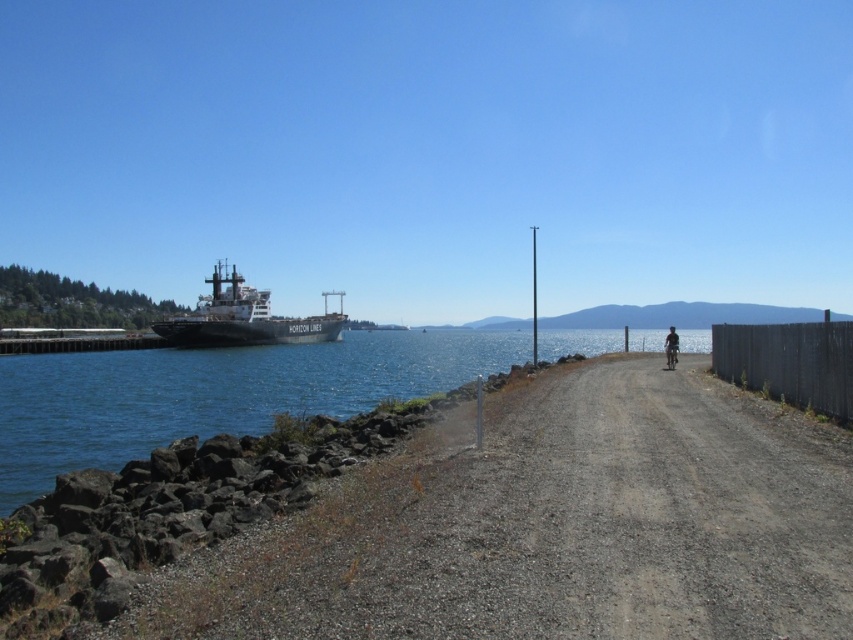
Question: Which object is farther from the camera taking this photo?

Choices:
 (A) dark blue fabric bicycle at right
 (B) white matte cargo ship at left
 (C) blue water at left

Answer: (B)

Question: Among these points, which one is nearest to the camera?

Choices:
 (A) (172, 330)
 (B) (675, 356)
 (C) (846, 416)
 (D) (515, 486)

Answer: (D)

Question: Does dirt/gravel path at center lie behind dark blue fabric bicycle at right?

Choices:
 (A) yes
 (B) no

Answer: (B)

Question: From the image, what is the correct spatial relationship of dirt/gravel path at center in relation to blue water at left?

Choices:
 (A) left
 (B) right

Answer: (B)

Question: Can you confirm if blue water at left is positioned below white matte cargo ship at left?

Choices:
 (A) no
 (B) yes

Answer: (B)

Question: Based on their relative distances, which object is farther from the dirt/gravel path at center?

Choices:
 (A) black wooden fence at right
 (B) blue water at left

Answer: (B)